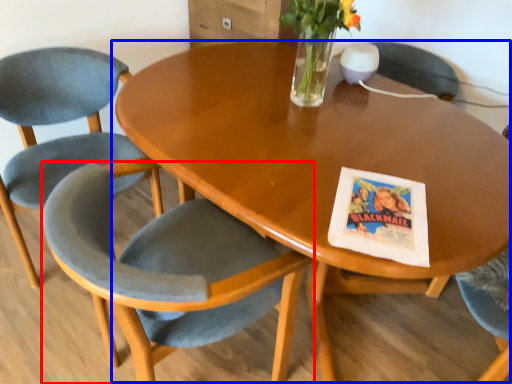
Question: Which of the following is the farthest to the observer, chair (highlighted by a red box) or coffee table (highlighted by a blue box)?

Choices:
 (A) chair
 (B) coffee table

Answer: (B)